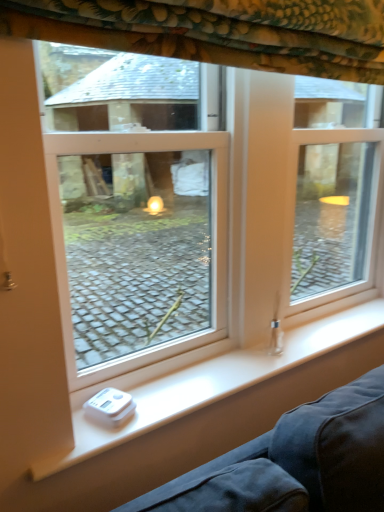
Question: From a real-world perspective, is white plastic window at center physically located above or below white plastic scale at lower left?

Choices:
 (A) above
 (B) below

Answer: (A)

Question: Is point (64, 211) closer or farther from the camera than point (259, 374)?

Choices:
 (A) farther
 (B) closer

Answer: (A)

Question: Which is nearer to the white plastic window at center?

Choices:
 (A) white plastic scale at lower left
 (B) floral fabric curtain at upper center

Answer: (A)

Question: Considering the real-world distances, which object is closest to the white plastic scale at lower left?

Choices:
 (A) floral fabric curtain at upper center
 (B) white plastic window at center

Answer: (A)